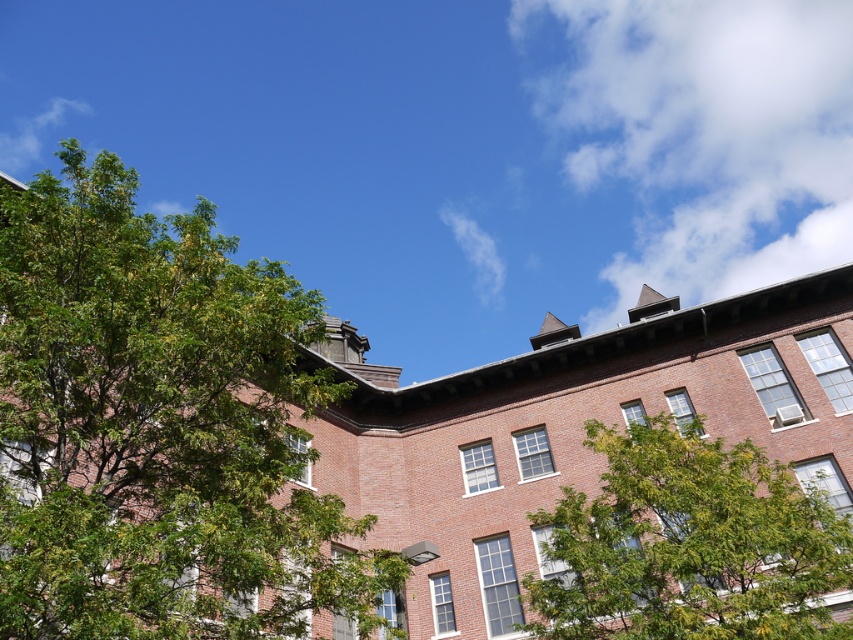
Question: Where is green leafy tree at upper left located in relation to green leafy tree at lower right in the image?

Choices:
 (A) right
 (B) left

Answer: (B)

Question: Can you confirm if green leafy tree at upper left is thinner than green leafy tree at lower right?

Choices:
 (A) yes
 (B) no

Answer: (B)

Question: Where is green leafy tree at upper left located in relation to green leafy tree at lower right in the image?

Choices:
 (A) below
 (B) above

Answer: (B)

Question: Which point is closer to the camera taking this photo?

Choices:
 (A) (784, 598)
 (B) (148, 588)

Answer: (B)

Question: Among these objects, which one is nearest to the camera?

Choices:
 (A) green leafy tree at lower right
 (B) green leafy tree at upper left

Answer: (B)